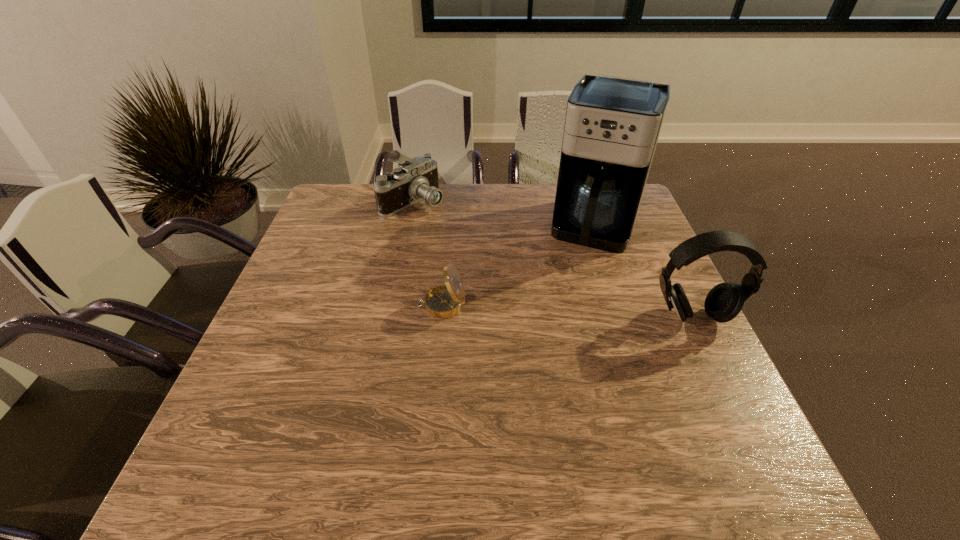
You are a GUI agent. You are given a task and a screenshot of the screen. Output one action in this format:
    pyautogui.click(x=<x>, y=<y>)
    Task: Click on the free region at the near edge
    This screenshot has width=960, height=540.
    Given the screenshot: What is the action you would take?
    pyautogui.click(x=525, y=420)

In the image, there is a desktop. Where is `vacant space at the left edge`? The height and width of the screenshot is (540, 960). vacant space at the left edge is located at coordinates (276, 390).

In the image, there is a desktop. At what (x,y) coordinates should I click in order to perform the action: click on blank space at the right edge. Please return your answer as a coordinate pair (x, y). The image size is (960, 540). Looking at the image, I should click on (625, 301).

I want to click on free space at the near left corner of the desktop, so click(x=299, y=430).

At what (x,y) coordinates should I click in order to perform the action: click on free spot between the tallest object and the compass. Please return your answer as a coordinate pair (x, y). The height and width of the screenshot is (540, 960). Looking at the image, I should click on (518, 266).

Locate an element on the screen. This screenshot has width=960, height=540. vacant point located between the coffee maker and the compass is located at coordinates (518, 266).

Where is `free space between the earphone and the camera`? Image resolution: width=960 pixels, height=540 pixels. free space between the earphone and the camera is located at coordinates (553, 259).

The image size is (960, 540). Identify the location of unoccupied area between the tallest object and the earphone. (644, 272).

Image resolution: width=960 pixels, height=540 pixels. What are the coordinates of `free space between the compass and the coffee maker` in the screenshot? It's located at (518, 266).

Identify the location of free space between the second tallest object and the camera. The height and width of the screenshot is (540, 960). (553, 259).